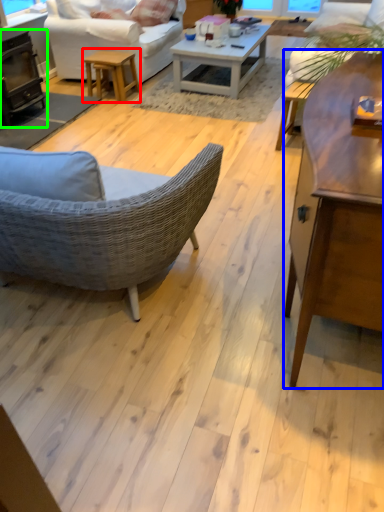
Question: Which is farther away from table (highlighted by a red box)? coffee table (highlighted by a blue box) or fireplace (highlighted by a green box)?

Choices:
 (A) coffee table
 (B) fireplace

Answer: (A)